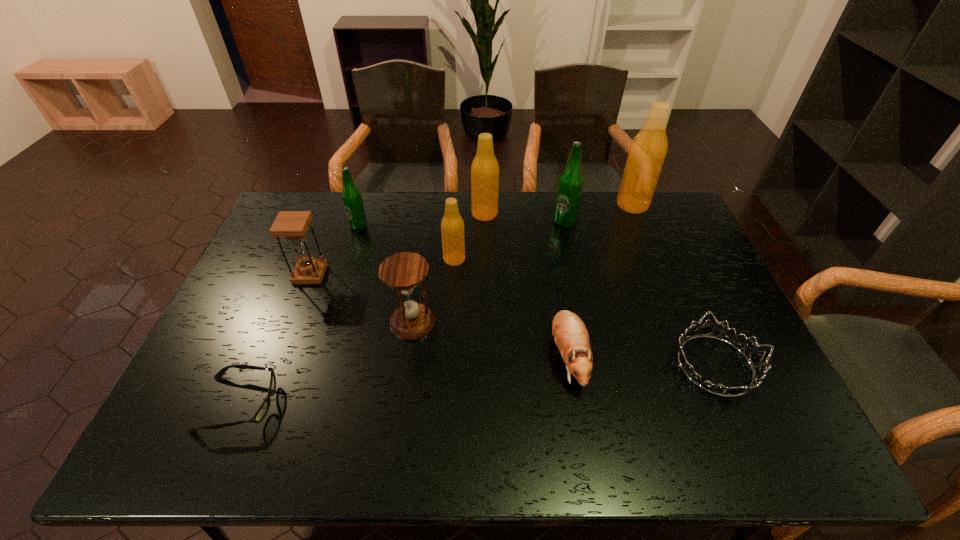
Identify which object is located as the nearest to the smallest tan beer bottle. Please provide its 2D coordinates. Your answer should be formatted as a tuple, i.e. [(x, y)], where the tuple contains the x and y coordinates of a point satisfying the conditions above.

[(485, 169)]

The width and height of the screenshot is (960, 540). I want to click on the second closest object to the brown hamster, so click(404, 272).

Find the location of a particular element. beer bottle identified as the fifth closest to the right hourglass is located at coordinates (648, 150).

Find the location of a particular element. The image size is (960, 540). beer bottle that stands as the closest to the leftmost beer bottle is located at coordinates (452, 225).

In order to click on tan beer bottle that is the closest to the spectacles in this screenshot , I will do `click(452, 225)`.

The height and width of the screenshot is (540, 960). In order to click on tan beer bottle that is the closest one to the second smallest tan beer bottle in this screenshot , I will do `click(452, 225)`.

The width and height of the screenshot is (960, 540). I want to click on free space that satisfies the following two spatial constraints: 1. on the label of the second beer bottle from left to right; 2. on the right side of the smaller green beer bottle, so click(x=348, y=259).

The height and width of the screenshot is (540, 960). Find the location of `vacant space that satisfies the following two spatial constraints: 1. on the back side of the sixth object from right to left; 2. on the right side of the second tan beer bottle from left to right`. vacant space that satisfies the following two spatial constraints: 1. on the back side of the sixth object from right to left; 2. on the right side of the second tan beer bottle from left to right is located at coordinates (457, 214).